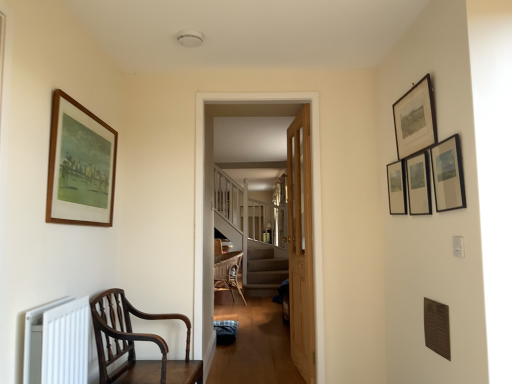
Question: Is white matte radiator at lower left to the right of wooden door at center from the viewer's perspective?

Choices:
 (A) yes
 (B) no

Answer: (B)

Question: Could you tell me if white matte radiator at lower left is turned towards wooden door at center?

Choices:
 (A) yes
 (B) no

Answer: (B)

Question: Is white matte radiator at lower left oriented away from wooden door at center?

Choices:
 (A) yes
 (B) no

Answer: (B)

Question: Would you consider white matte radiator at lower left to be distant from wooden door at center?

Choices:
 (A) yes
 (B) no

Answer: (A)

Question: Does white matte radiator at lower left contain wooden door at center?

Choices:
 (A) no
 (B) yes

Answer: (A)

Question: Can you see white matte radiator at lower left touching wooden door at center?

Choices:
 (A) yes
 (B) no

Answer: (B)

Question: From a real-world perspective, is wooden door at center under matte black picture frame at upper right, placed as the second picture frame when sorted from right to left?

Choices:
 (A) yes
 (B) no

Answer: (A)

Question: From a real-world perspective, is wooden door at center over matte black picture frame at upper right, placed as the second picture frame when sorted from right to left?

Choices:
 (A) yes
 (B) no

Answer: (B)

Question: Is wooden door at center positioned before matte black picture frame at upper right, placed as the fourth picture frame when sorted from left to right?

Choices:
 (A) yes
 (B) no

Answer: (B)

Question: Does wooden door at center have a lesser width compared to matte black picture frame at upper right, placed as the fourth picture frame when sorted from left to right?

Choices:
 (A) no
 (B) yes

Answer: (A)

Question: Can you confirm if wooden door at center is wider than matte black picture frame at upper right, placed as the second picture frame when sorted from right to left?

Choices:
 (A) yes
 (B) no

Answer: (A)

Question: Can matte black picture frame at upper right, placed as the fourth picture frame when sorted from left to right, be found inside wooden door at center?

Choices:
 (A) no
 (B) yes

Answer: (A)

Question: Is matte black picture frame at upper right, the third picture frame from the right, a part of mahogany wood chair at lower left?

Choices:
 (A) no
 (B) yes

Answer: (A)